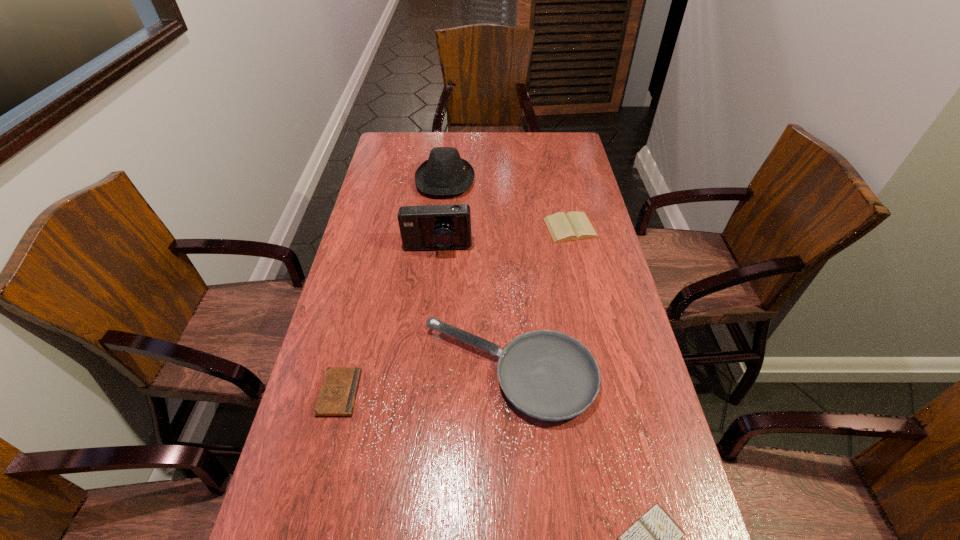
The width and height of the screenshot is (960, 540). In order to click on blank space that satisfies the following two spatial constraints: 1. on the front-facing side of the fourth shortest object; 2. on the left side of the camera in this screenshot , I will do `click(425, 371)`.

In order to click on free region that satisfies the following two spatial constraints: 1. on the front-facing side of the third tallest object; 2. on the right side of the tallest object in this screenshot , I will do `click(425, 371)`.

Locate an element on the screen. The image size is (960, 540). free space that satisfies the following two spatial constraints: 1. on the front-facing side of the tallest diary; 2. on the right side of the fedora is located at coordinates (441, 228).

Locate an element on the screen. free space that satisfies the following two spatial constraints: 1. on the front-facing side of the camera; 2. on the left side of the frying pan is located at coordinates (425, 371).

Locate an element on the screen. free space that satisfies the following two spatial constraints: 1. on the front-facing side of the farthest diary; 2. on the right side of the farthest object is located at coordinates (441, 228).

Locate an element on the screen. Image resolution: width=960 pixels, height=540 pixels. free space that satisfies the following two spatial constraints: 1. on the front-facing side of the third tallest object; 2. on the left side of the tallest object is located at coordinates (425, 371).